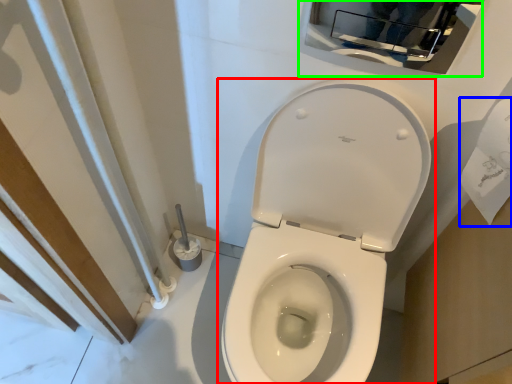
Question: Estimate the real-world distances between objects in this image. Which object is closer to toilet (highlighted by a red box), toilet paper (highlighted by a blue box) or medicine cabinet (highlighted by a green box)?

Choices:
 (A) toilet paper
 (B) medicine cabinet

Answer: (A)